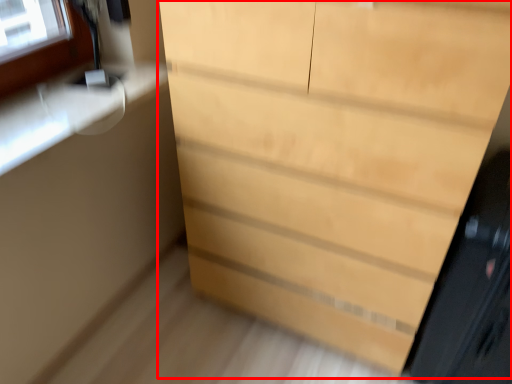
Question: From the image's perspective, what is the correct spatial positioning of chest of drawers (annotated by the red box) in reference to screen door?

Choices:
 (A) below
 (B) above

Answer: (B)